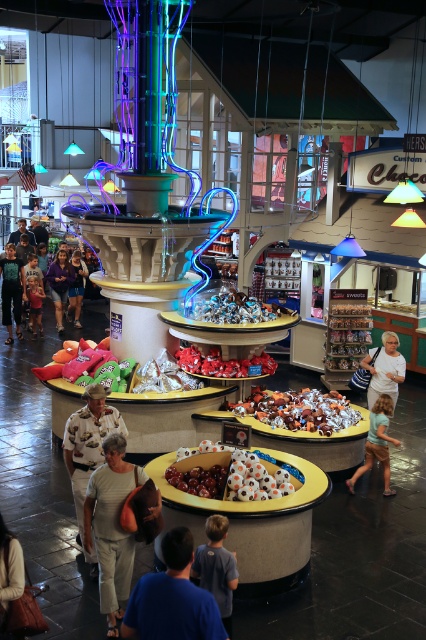
Can you confirm if light beige fabric pants at lower center is taller than metallic chocolate at center?

Correct, light beige fabric pants at lower center is much taller as metallic chocolate at center.

Can you confirm if light beige fabric pants at lower center is positioned to the right of metallic chocolate at center?

Incorrect, light beige fabric pants at lower center is not on the right side of metallic chocolate at center.

Does point (120, 481) come behind point (284, 420)?

No, it is in front of (284, 420).

Where is `light beige fabric pants at lower center`? The image size is (426, 640). light beige fabric pants at lower center is located at coordinates (112, 525).

Does camouflage shirt at center have a lesser height compared to shiny metallic balls at center?

Incorrect, camouflage shirt at center's height does not fall short of shiny metallic balls at center's.

Who is more forward, (75, 449) or (195, 458)?

Positioned in front is point (75, 449).

This screenshot has height=640, width=426. What are the coordinates of `camouflage shirt at center` in the screenshot? It's located at (88, 442).

Based on the photo, does light beige fabric pants at lower center come in front of light blue denim shorts at lower right?

Yes, it is.

Is light beige fabric pants at lower center shorter than light blue denim shorts at lower right?

No, light beige fabric pants at lower center is not shorter than light blue denim shorts at lower right.

Between point (126, 461) and point (383, 452), which one is positioned behind?

The point (126, 461) is behind.

Identify the location of light beige fabric pants at lower center. coord(112,525).